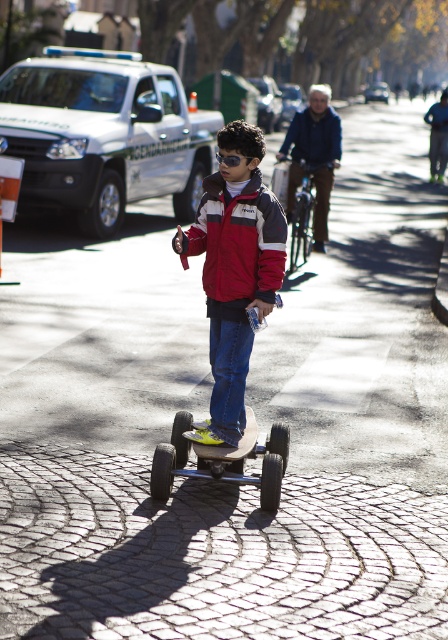
Does red matte jacket at center have a greater height compared to metallic silver skateboard at center?

Indeed, red matte jacket at center has a greater height compared to metallic silver skateboard at center.

Where is `red matte jacket at center`? Image resolution: width=448 pixels, height=640 pixels. red matte jacket at center is located at coordinates (238, 241).

Between point (241, 184) and point (214, 237), which one is positioned behind?

The point (214, 237) is more distant.

Is red jacket at center wider than red matte jacket at center?

Correct, the width of red jacket at center exceeds that of red matte jacket at center.

Is point (222, 422) less distant than point (196, 232)?

Yes, point (222, 422) is closer to viewer.

I want to click on red jacket at center, so click(x=235, y=269).

Which is below, metallic silver skateboard at center or black rubber skateboard at center?

metallic silver skateboard at center is lower down.

Who is shorter, metallic silver skateboard at center or black rubber skateboard at center?

Standing shorter between the two is black rubber skateboard at center.

What do you see at coordinates (224, 460) in the screenshot? I see `metallic silver skateboard at center` at bounding box center [224, 460].

The image size is (448, 640). What are the coordinates of `metallic silver skateboard at center` in the screenshot? It's located at (224, 460).